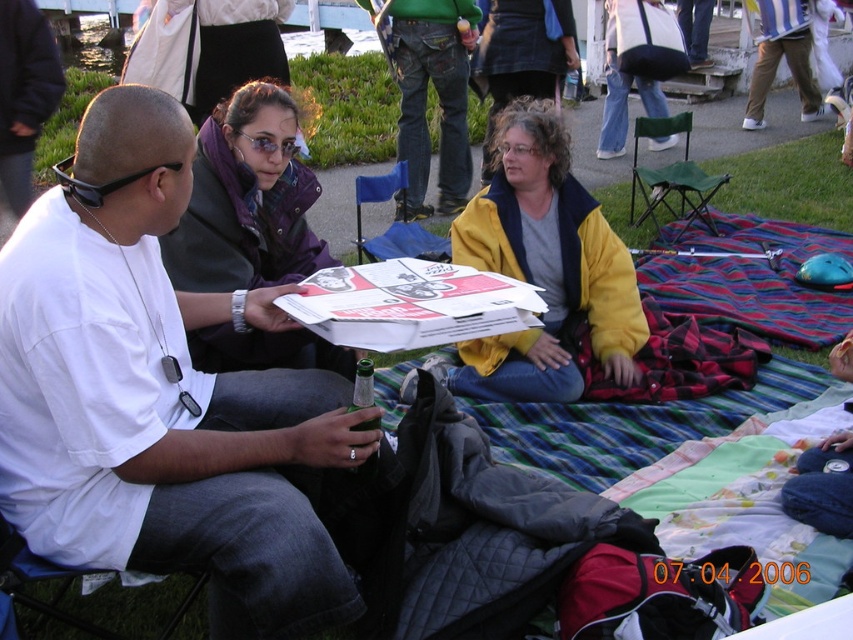
Question: Is yellow fleece jacket at center positioned in front of matte purple jacket at center?

Choices:
 (A) yes
 (B) no

Answer: (B)

Question: Among these points, which one is farthest from the camera?

Choices:
 (A) (544, 376)
 (B) (270, 184)
 (C) (213, 612)

Answer: (A)

Question: Estimate the real-world distances between objects in this image. Which object is farther from the white matte shirt at center?

Choices:
 (A) matte purple jacket at center
 (B) yellow fleece jacket at center

Answer: (B)

Question: Among these objects, which one is nearest to the camera?

Choices:
 (A) matte purple jacket at center
 (B) white matte shirt at center
 (C) yellow fleece jacket at center

Answer: (B)

Question: Does white matte shirt at center have a lesser width compared to yellow fleece jacket at center?

Choices:
 (A) yes
 (B) no

Answer: (A)

Question: Does white matte shirt at center appear on the left side of matte purple jacket at center?

Choices:
 (A) no
 (B) yes

Answer: (B)